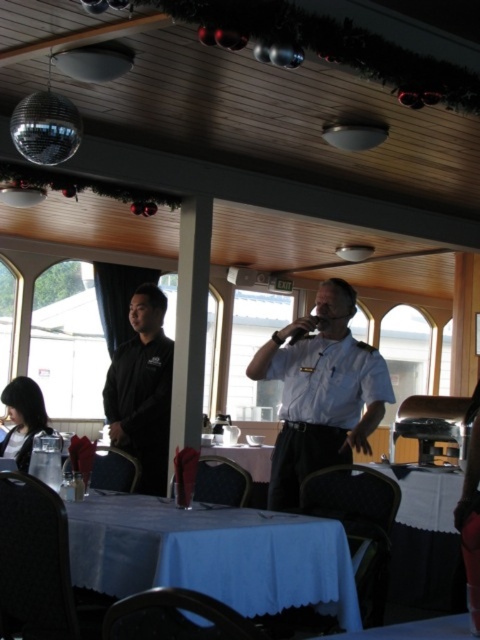
Is point (94, 568) more distant than point (146, 460)?

No, (94, 568) is in front of (146, 460).

Measure the distance between blue fabric table at lower center and camera.

6.43 feet

Where is `blue fabric table at lower center`? The width and height of the screenshot is (480, 640). blue fabric table at lower center is located at coordinates (163, 557).

Does white uniform at center have a smaller size compared to black smooth shirt at left?

Incorrect, white uniform at center is not smaller in size than black smooth shirt at left.

Between point (303, 352) and point (108, 394), which one is positioned behind?

The point (108, 394) is behind.

What are the coordinates of `white uniform at center` in the screenshot? It's located at (321, 392).

Can you confirm if blue fabric table at lower center is wider than white uniform at center?

Yes, blue fabric table at lower center is wider than white uniform at center.

Is the position of blue fabric table at lower center less distant than that of white uniform at center?

Yes, blue fabric table at lower center is in front of white uniform at center.

Which is behind, point (88, 552) or point (269, 346)?

The point (269, 346) is more distant.

You are a GUI agent. You are given a task and a screenshot of the screen. Output one action in this format:
    pyautogui.click(x=<x>, y=<y>)
    Task: Click on the blue fabric table at lower center
    The height and width of the screenshot is (640, 480).
    Given the screenshot: What is the action you would take?
    pyautogui.click(x=163, y=557)